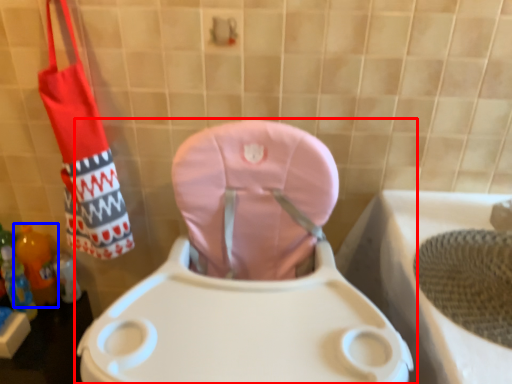
Question: Which object is further to the camera taking this photo, toilet (highlighted by a red box) or bottle (highlighted by a blue box)?

Choices:
 (A) toilet
 (B) bottle

Answer: (B)